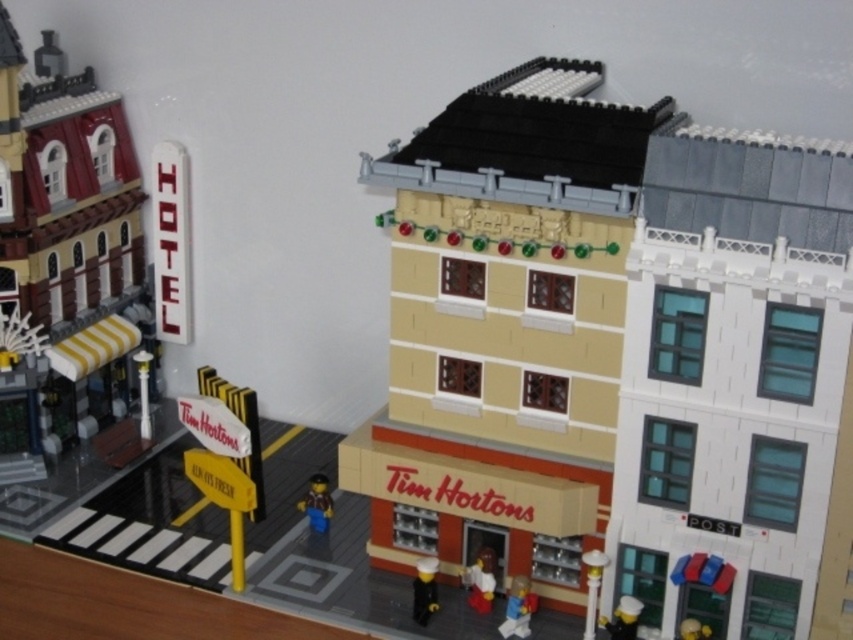
Question: Is brown plastic minifigure at lower center thinner than black plastic toy at lower right?

Choices:
 (A) no
 (B) yes

Answer: (A)

Question: Is the position of matte red chef hat at center more distant than that of brown plastic minifigure at lower center?

Choices:
 (A) yes
 (B) no

Answer: (B)

Question: Which of the following is the farthest from the observer?

Choices:
 (A) 473,577
 (B) 624,604
 (C) 508,621

Answer: (A)

Question: Is yellow striped awning at left closer to the viewer compared to matte red chef hat at center?

Choices:
 (A) no
 (B) yes

Answer: (A)

Question: Which object is positioned closest to the matte red chef hat at center?

Choices:
 (A) yellow matte toy at lower right
 (B) yellow striped awning at left
 (C) smooth plastic figure at lower center
 (D) black plastic toy at lower right

Answer: (C)

Question: Which of the following is the farthest from the observer?

Choices:
 (A) yellow striped awning at left
 (B) brown plastic minifigure at lower center
 (C) black plastic toy at lower right
 (D) matte red chef hat at center

Answer: (B)